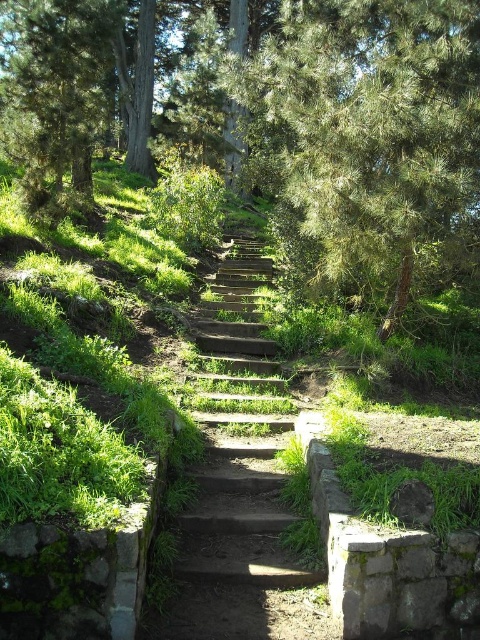
Is green textured pine forest at center thinner than wooden stairs at center?

No, green textured pine forest at center is not thinner than wooden stairs at center.

Can you confirm if green textured pine forest at center is positioned below wooden stairs at center?

Actually, green textured pine forest at center is above wooden stairs at center.

Between point (469, 186) and point (235, 252), which one is positioned in front?

Positioned in front is point (469, 186).

Image resolution: width=480 pixels, height=640 pixels. In order to click on green textured pine forest at center in this screenshot , I will do coord(347,132).